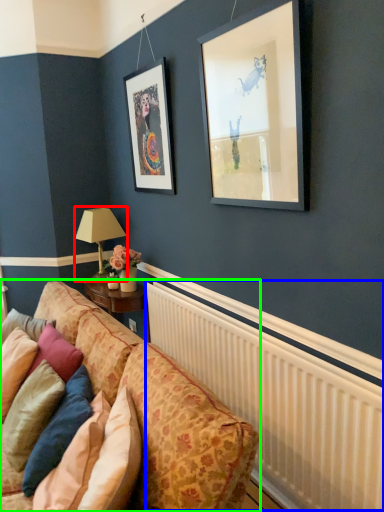
Question: Which object is positioned closest to table lamp (highlighted by a red box)? Select from radiator (highlighted by a blue box) and studio couch (highlighted by a green box).

Choices:
 (A) radiator
 (B) studio couch

Answer: (B)